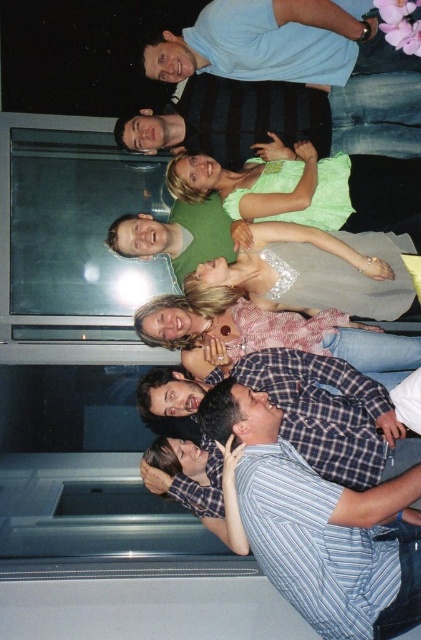
Between matte black shirt at upper center and green satin blouse at upper center, which one has less height?

With less height is matte black shirt at upper center.

How much distance is there between matte black shirt at upper center and green satin blouse at upper center?

matte black shirt at upper center is 9.27 inches from green satin blouse at upper center.

Between point (362, 144) and point (317, 177), which one is positioned behind?

Point (362, 144)

Find the location of a particular element. The width and height of the screenshot is (421, 640). matte black shirt at upper center is located at coordinates (376, 115).

Is point (170, 51) closer to viewer compared to point (391, 113)?

No, (170, 51) is further to viewer.

Does light blue shirt at upper center come in front of matte black shirt at upper center?

That is True.

Locate an element on the screen. light blue shirt at upper center is located at coordinates (279, 42).

Is striped cotton shirt at lower right positioned behind light blue shirt at upper center?

No, it is in front of light blue shirt at upper center.

Does striped cotton shirt at lower right have a larger size compared to light blue shirt at upper center?

Indeed, striped cotton shirt at lower right has a larger size compared to light blue shirt at upper center.

Find the location of `striped cotton shirt at lower right`. striped cotton shirt at lower right is located at coordinates (320, 525).

Locate an element on the screen. striped cotton shirt at lower right is located at coordinates (320, 525).